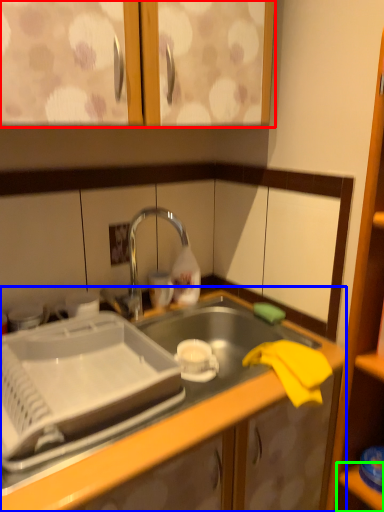
Question: Based on their relative distances, which object is farther from cabinetry (highlighted by a red box)? Choose from countertop (highlighted by a blue box) and shelf (highlighted by a green box).

Choices:
 (A) countertop
 (B) shelf

Answer: (B)